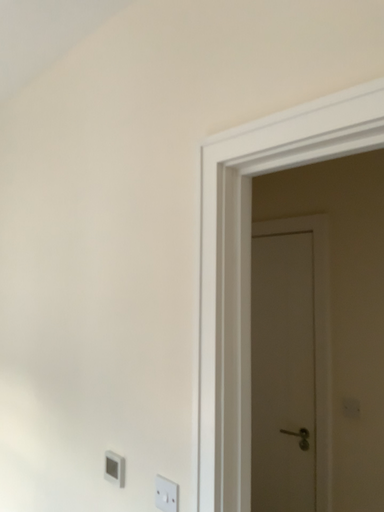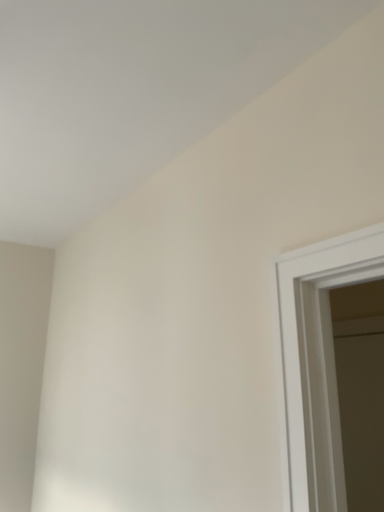
Question: How did the camera likely rotate when shooting the video?

Choices:
 (A) rotated downward
 (B) rotated upward

Answer: (B)